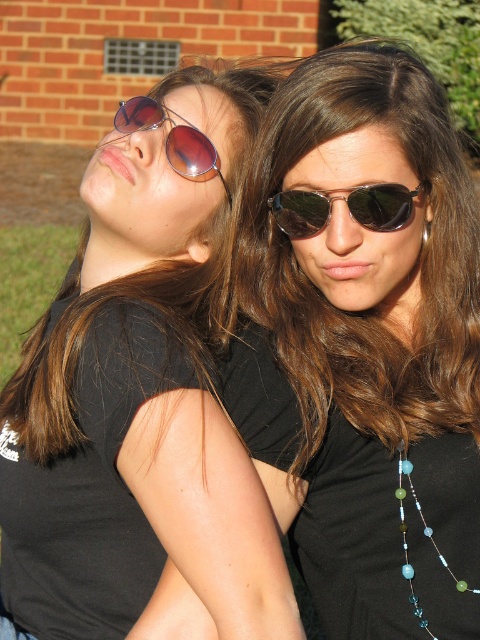
Does shiny dark sunglasses at center have a lesser width compared to translucent glass beads at center?

Incorrect, shiny dark sunglasses at center's width is not less than translucent glass beads at center's.

Which is more to the right, shiny dark sunglasses at center or translucent glass beads at center?

From the viewer's perspective, translucent glass beads at center appears more on the right side.

The image size is (480, 640). Identify the location of shiny dark sunglasses at center. (347, 205).

Can you confirm if matte black sunglasses at upper left is positioned below metallic reflective sunglasses at upper center?

Yes, matte black sunglasses at upper left is below metallic reflective sunglasses at upper center.

What do you see at coordinates (141, 392) in the screenshot?
I see `matte black sunglasses at upper left` at bounding box center [141, 392].

Identify the location of matte black sunglasses at upper left. (141, 392).

Does shiny dark sunglasses at center appear over metallic reflective sunglasses at upper center?

No, shiny dark sunglasses at center is not above metallic reflective sunglasses at upper center.

Which is behind, point (394, 214) or point (137, 108)?

The point (137, 108) is more distant.

Locate an element on the screen. The image size is (480, 640). shiny dark sunglasses at center is located at coordinates (347, 205).